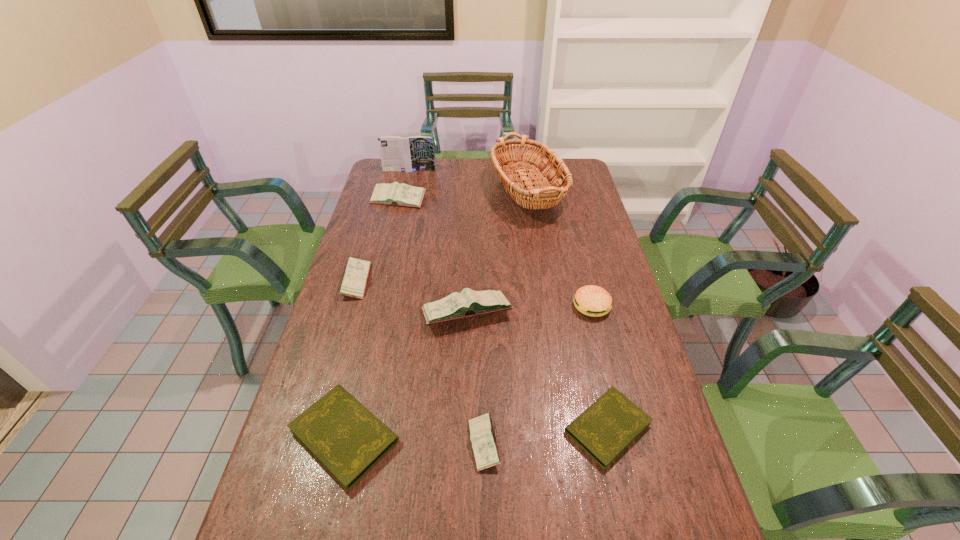
I want to click on vacant region between the patty and the third tallest object, so click(529, 310).

Locate an element on the screen. This screenshot has height=540, width=960. unoccupied position between the patty and the basket is located at coordinates (560, 251).

The width and height of the screenshot is (960, 540). In order to click on object that stands as the closest to the smallest pink diary in this screenshot , I will do point(605,429).

Choose which object is the nearest neighbor to the smallest pink diary. Please provide its 2D coordinates. Your answer should be formatted as a tuple, i.e. [(x, y)], where the tuple contains the x and y coordinates of a point satisfying the conditions above.

[(605, 429)]

Identify which diary is the fourth closest to the biggest pink diary. Please provide its 2D coordinates. Your answer should be formatted as a tuple, i.e. [(x, y)], where the tuple contains the x and y coordinates of a point satisfying the conditions above.

[(482, 435)]

Locate an element on the screen. diary that is the second closest to the shortest diary is located at coordinates (469, 303).

Choose which pink diary is the third nearest neighbor to the second tallest object. Please provide its 2D coordinates. Your answer should be formatted as a tuple, i.e. [(x, y)], where the tuple contains the x and y coordinates of a point satisfying the conditions above.

[(469, 303)]

Find the location of a particular element. The image size is (960, 540). pink diary that can be found as the closest to the patty is located at coordinates (469, 303).

Locate which green diary ranks second in proximity to the fourth shortest diary. Please provide its 2D coordinates. Your answer should be formatted as a tuple, i.e. [(x, y)], where the tuple contains the x and y coordinates of a point satisfying the conditions above.

[(605, 429)]

Where is `the closest green diary to the third shortest diary`? Image resolution: width=960 pixels, height=540 pixels. the closest green diary to the third shortest diary is located at coordinates (605, 429).